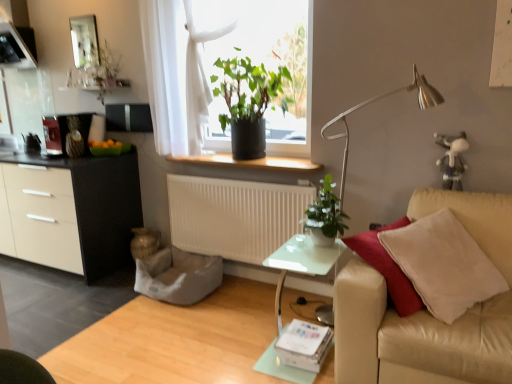
Question: Is beige leather couch at right in front of or behind matte silver mirror at upper left in the image?

Choices:
 (A) front
 (B) behind

Answer: (A)

Question: Is point (422, 344) closer or farther from the camera than point (88, 31)?

Choices:
 (A) farther
 (B) closer

Answer: (B)

Question: Which of these objects is positioned farthest from the gray fabric swivel chair at lower center?

Choices:
 (A) green matte plant at center, the second houseplant from the left
 (B) green leafy plant at center
 (C) clear glass table at center
 (D) matte silver mirror at upper left
 (E) beige leather couch at right

Answer: (D)

Question: Which is nearer to the silver metallic floor lamp at right?

Choices:
 (A) matte black cabinet at left
 (B) smooth beige couch at right
 (C) clear glass table at center
 (D) green matte plant at center, the 2th houseplant from the back
 (E) black plastic window sill at center

Answer: (E)